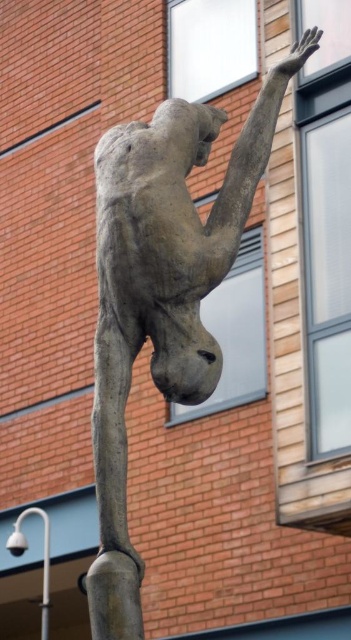
The image size is (351, 640). What are the coordinates of `bronze statue at center` in the screenshot? It's located at (162, 292).

Between bronze statue at center and white metal pole at lower left, which one is positioned lower?

Positioned lower is white metal pole at lower left.

Who is more forward, (118,636) or (16,548)?

Positioned in front is point (118,636).

I want to click on bronze statue at center, so click(162, 292).